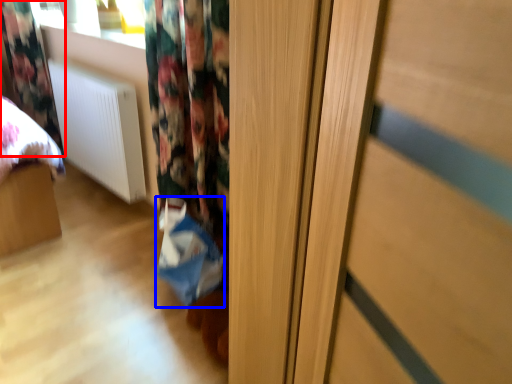
Question: Which object is closer to the camera taking this photo, curtain (highlighted by a red box) or shopping bag (highlighted by a blue box)?

Choices:
 (A) curtain
 (B) shopping bag

Answer: (B)